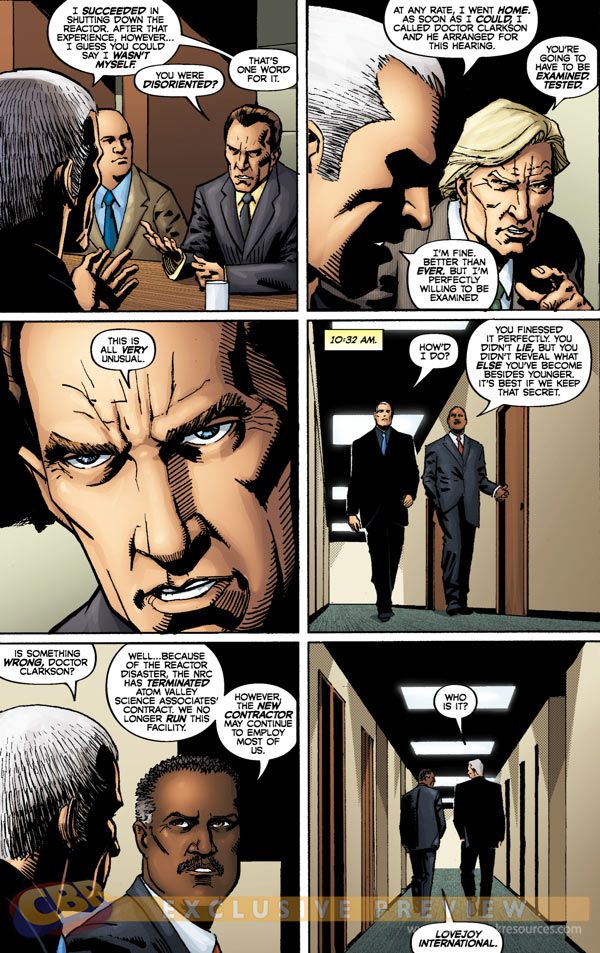
Find the location of `light`. light is located at coordinates (407, 697), (425, 741), (445, 777), (445, 801), (352, 430), (342, 492), (337, 524), (387, 325).